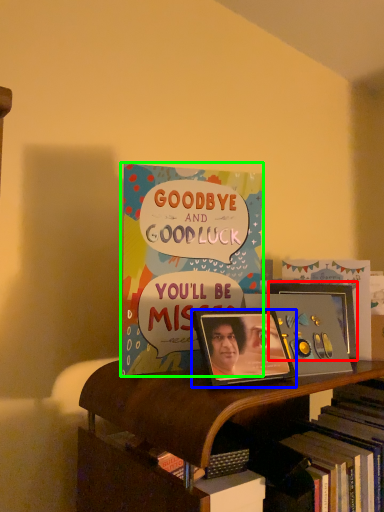
Question: Estimate the real-world distances between objects in this image. Which object is closer to picture frame (highlighted by a red box), picture frame (highlighted by a blue box) or book (highlighted by a green box)?

Choices:
 (A) picture frame
 (B) book

Answer: (A)